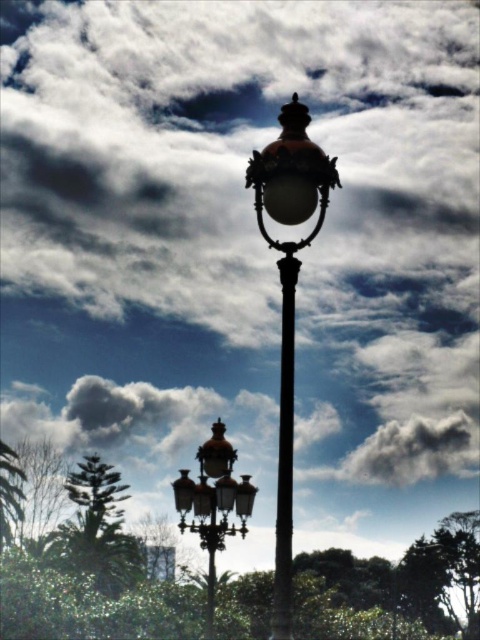
You are a city planner assessing the placement of the glossy brass streetlight at upper center and the black polished pole at center. Based on their positions, which object is higher in the image?

The glossy brass streetlight at upper center is higher in the image than the black polished pole at center.

You are a city planner assessing the placement of two streetlights in a pedestrian area. The polished brass lamp post at center and the glossy brass streetlight at upper center are part of a new design. Given that the minimum required distance between streetlights for safety is 4 feet, will these two fixtures comply with the safety regulations?

The polished brass lamp post at center is 3.97 feet away from the glossy brass streetlight at upper center. Since 3.97 feet is less than the required 4 feet, the two fixtures do not comply with the safety regulations.

You are standing at the point marked by the coordinate point (288, 298). Which object in the scene is located exactly at this coordinate?

The polished brass lamp post at center is located exactly at the coordinate point (288, 298).